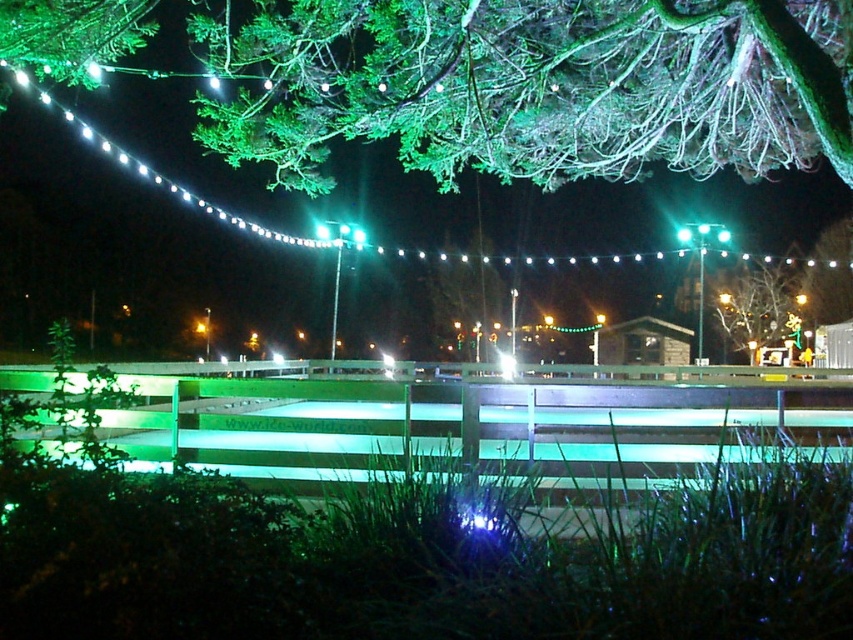
Question: Which of the following is the farthest from the observer?

Choices:
 (A) (740, 317)
 (B) (201, 120)

Answer: (A)

Question: Is green leafy branches at upper center above green matte tree at upper center?

Choices:
 (A) yes
 (B) no

Answer: (A)

Question: Can you confirm if green leafy branches at upper center is positioned to the right of green matte tree at upper center?

Choices:
 (A) yes
 (B) no

Answer: (B)

Question: Can you confirm if green leafy branches at upper center is bigger than green matte tree at upper center?

Choices:
 (A) yes
 (B) no

Answer: (A)

Question: Which object is farther from the camera taking this photo?

Choices:
 (A) green leafy branches at upper center
 (B) green matte tree at upper center

Answer: (B)